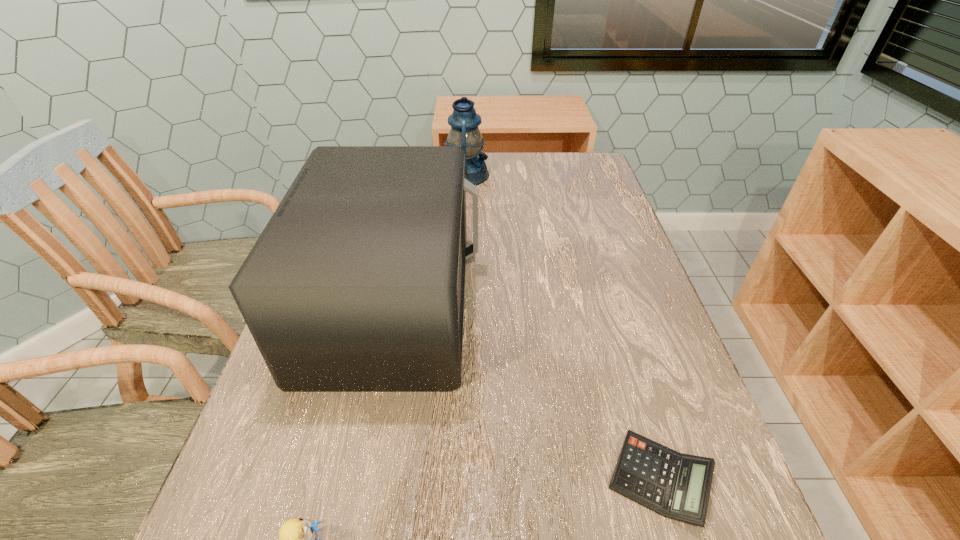
Locate an element on the screen. This screenshot has width=960, height=540. microwave oven is located at coordinates (357, 283).

Image resolution: width=960 pixels, height=540 pixels. I want to click on lantern, so [464, 133].

The width and height of the screenshot is (960, 540). I want to click on the rightmost object, so click(674, 485).

This screenshot has width=960, height=540. Find the location of `calculator`. calculator is located at coordinates (674, 485).

Find the location of `vacant area situated on the front-facing side of the microwave oven`. vacant area situated on the front-facing side of the microwave oven is located at coordinates (637, 303).

This screenshot has width=960, height=540. I want to click on vacant area situated on the face of the farthest object, so [x=588, y=175].

This screenshot has width=960, height=540. I want to click on vacant space located 0.400m on the left of the shortest object, so click(348, 479).

Where is `object that is at the far edge`? object that is at the far edge is located at coordinates (464, 133).

Where is `object located at the left edge`? object located at the left edge is located at coordinates (357, 283).

Image resolution: width=960 pixels, height=540 pixels. What are the coordinates of `object positioned at the right edge` in the screenshot? It's located at (674, 485).